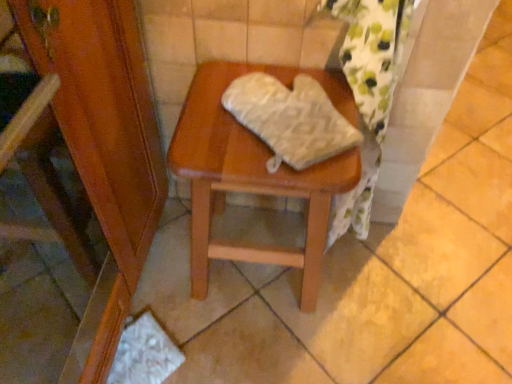
Question: Should I look upward or downward to see white textured oven mitt at center?

Choices:
 (A) up
 (B) down

Answer: (A)

Question: Is white textured oven mitt at center completely or partially inside wooden stool at center?

Choices:
 (A) yes
 (B) no

Answer: (B)

Question: Can you confirm if wooden stool at center is positioned to the right of white textured oven mitt at center?

Choices:
 (A) yes
 (B) no

Answer: (B)

Question: Does wooden stool at center appear on the left side of white textured oven mitt at center?

Choices:
 (A) yes
 (B) no

Answer: (A)

Question: Is wooden stool at center thinner than white textured oven mitt at center?

Choices:
 (A) no
 (B) yes

Answer: (A)

Question: From the image's perspective, is wooden stool at center located beneath white textured oven mitt at center?

Choices:
 (A) yes
 (B) no

Answer: (A)

Question: Can you see wooden stool at center touching white textured oven mitt at center?

Choices:
 (A) no
 (B) yes

Answer: (A)

Question: Is white textured oven mitt at center wider than wooden stool at center?

Choices:
 (A) yes
 (B) no

Answer: (B)

Question: From a real-world perspective, is white textured oven mitt at center on wooden stool at center?

Choices:
 (A) yes
 (B) no

Answer: (A)

Question: Is white textured oven mitt at center far away from wooden stool at center?

Choices:
 (A) yes
 (B) no

Answer: (B)

Question: Can you confirm if white textured oven mitt at center is positioned to the left of wooden stool at center?

Choices:
 (A) yes
 (B) no

Answer: (B)

Question: From a real-world perspective, is white textured oven mitt at center located beneath wooden stool at center?

Choices:
 (A) yes
 (B) no

Answer: (B)

Question: Is the position of white textured oven mitt at center more distant than that of wooden stool at center?

Choices:
 (A) no
 (B) yes

Answer: (A)

Question: Considering the relative positions of white textured oven mitt at center and wooden stool at center in the image provided, is white textured oven mitt at center to the left or to the right of wooden stool at center?

Choices:
 (A) right
 (B) left

Answer: (A)